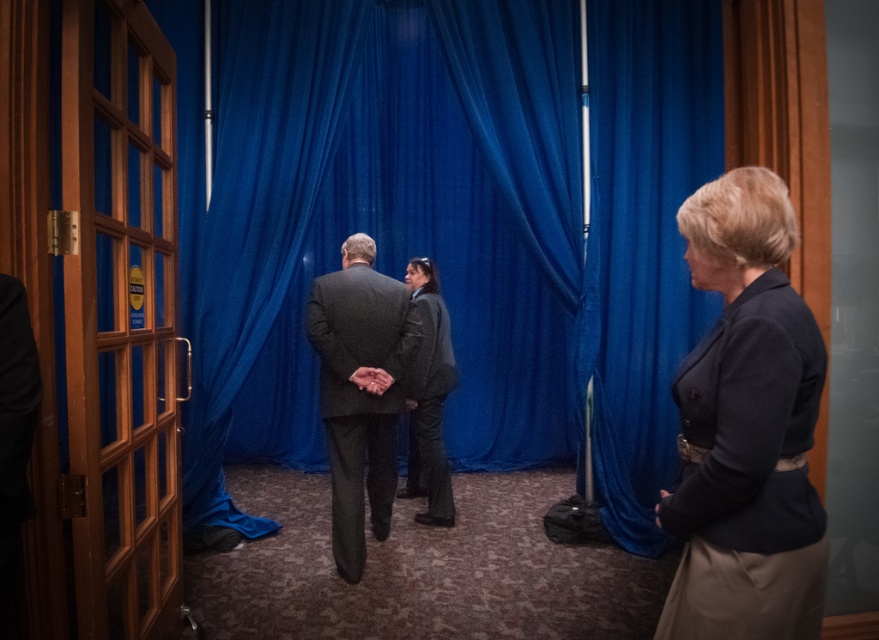
Looking at this image, which of these two, blue velvet curtain at center or dark gray textured coat at center, stands taller?

Standing taller between the two is blue velvet curtain at center.

Which of these two, blue velvet curtain at center or dark gray textured coat at center, stands shorter?

dark gray textured coat at center is shorter.

Describe the element at coordinates (462, 220) in the screenshot. I see `blue velvet curtain at center` at that location.

The height and width of the screenshot is (640, 879). Find the location of `blue velvet curtain at center`. blue velvet curtain at center is located at coordinates (462, 220).

Is wooden door at left smaller than dark gray textured coat at center?

Answer: Actually, wooden door at left might be larger than dark gray textured coat at center.

Does wooden door at left lie in front of dark gray textured coat at center?

Yes, it is.

Is point (100, 205) farther from camera compared to point (448, 506)?

No, (100, 205) is in front of (448, 506).

You are a GUI agent. You are given a task and a screenshot of the screen. Output one action in this format:
    pyautogui.click(x=<x>, y=<y>)
    Task: Click on the wooden door at left
    The width and height of the screenshot is (879, 640).
    Given the screenshot: What is the action you would take?
    [121, 317]

Between blue velvet curtain at center and wooden door at left, which one appears on the left side from the viewer's perspective?

wooden door at left is more to the left.

Does point (652, 269) lie in front of point (106, 284)?

Yes, point (652, 269) is closer to viewer.

You are a GUI agent. You are given a task and a screenshot of the screen. Output one action in this format:
    pyautogui.click(x=<x>, y=<y>)
    Task: Click on the blue velvet curtain at center
    This screenshot has width=879, height=640.
    Given the screenshot: What is the action you would take?
    pyautogui.click(x=462, y=220)